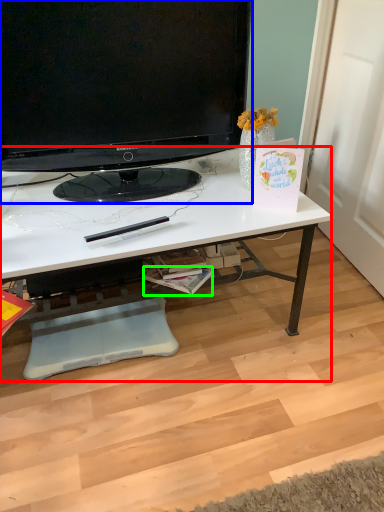
Question: Considering the real-world distances, which object is closest to desk (highlighted by a red box)? television (highlighted by a blue box) or magazine (highlighted by a green box).

Choices:
 (A) television
 (B) magazine

Answer: (A)